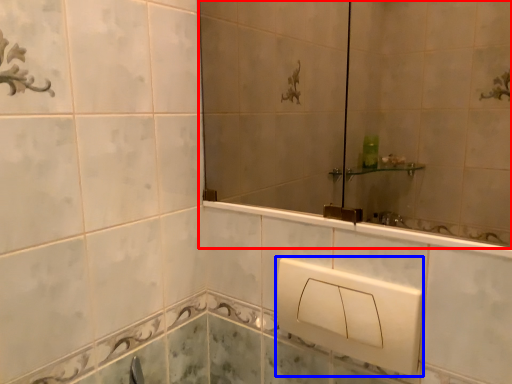
Question: Among these objects, which one is farthest to the camera, mirror (highlighted by a red box) or square (highlighted by a blue box)?

Choices:
 (A) mirror
 (B) square

Answer: (B)